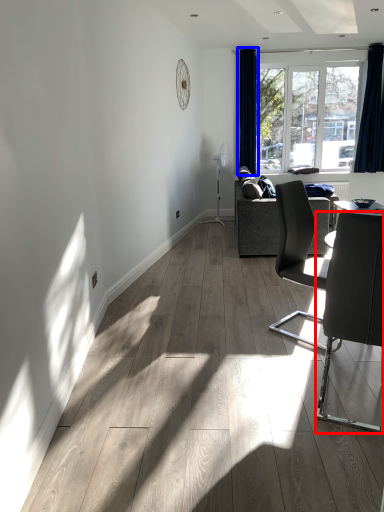
Question: Among these objects, which one is farthest to the camera, chair (highlighted by a red box) or curtain (highlighted by a blue box)?

Choices:
 (A) chair
 (B) curtain

Answer: (B)